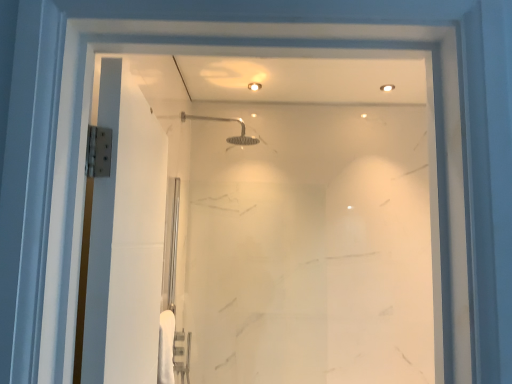
The image size is (512, 384). What do you see at coordinates (267, 221) in the screenshot? I see `transparent glass door at center` at bounding box center [267, 221].

Measure the distance between point (393, 321) and camera.

Point (393, 321) is 2.73 meters away from camera.

Find the location of a particular element. transparent glass door at center is located at coordinates (267, 221).

What is the approximate height of satin nickel shower head at upper center?

It is 7.47 inches.

Identify the location of satin nickel shower head at upper center. This screenshot has width=512, height=384. (226, 121).

The image size is (512, 384). What do you see at coordinates (226, 121) in the screenshot? I see `satin nickel shower head at upper center` at bounding box center [226, 121].

At what (x,y) coordinates should I click in order to perform the action: click on transparent glass door at center. Please return your answer as a coordinate pair (x, y). This screenshot has width=512, height=384. Looking at the image, I should click on (267, 221).

In the image, is transparent glass door at center on the left side or the right side of satin nickel shower head at upper center?

transparent glass door at center is positioned on satin nickel shower head at upper center's right side.

Is the position of transparent glass door at center less distant than that of satin nickel shower head at upper center?

Yes, transparent glass door at center is in front of satin nickel shower head at upper center.

Is point (413, 361) closer or farther from the camera than point (245, 137)?

Point (413, 361) is closer to the camera than point (245, 137).

From the image's perspective, is transparent glass door at center positioned above or below satin nickel shower head at upper center?

transparent glass door at center is below satin nickel shower head at upper center.

From a real-world perspective, is transparent glass door at center positioned under satin nickel shower head at upper center based on gravity?

Yes, from a real-world perspective, transparent glass door at center is beneath satin nickel shower head at upper center.

Considering the relative sizes of transparent glass door at center and satin nickel shower head at upper center in the image provided, is transparent glass door at center thinner than satin nickel shower head at upper center?

Yes.

In terms of height, does transparent glass door at center look taller or shorter compared to satin nickel shower head at upper center?

In the image, transparent glass door at center appears to be taller than satin nickel shower head at upper center.

Which of these two, transparent glass door at center or satin nickel shower head at upper center, is bigger?

With larger size is transparent glass door at center.

Would you say transparent glass door at center is inside or outside satin nickel shower head at upper center?

transparent glass door at center is not inside satin nickel shower head at upper center, it's outside.

Is transparent glass door at center with satin nickel shower head at upper center?

There is a gap between transparent glass door at center and satin nickel shower head at upper center.

Does transparent glass door at center turn towards satin nickel shower head at upper center?

Yes, transparent glass door at center is facing satin nickel shower head at upper center.

How many degrees apart are the facing directions of transparent glass door at center and satin nickel shower head at upper center?

There is a 88.6-degree angle between the facing directions of transparent glass door at center and satin nickel shower head at upper center.

Locate an element on the screen. This screenshot has width=512, height=384. glass door below the satin nickel shower head at upper center (from the image's perspective) is located at coordinates click(267, 221).

Which is more to the left, satin nickel shower head at upper center or transparent glass door at center?

satin nickel shower head at upper center is more to the left.

Which object is further away from the camera, satin nickel shower head at upper center or transparent glass door at center?

satin nickel shower head at upper center is further away from the camera.

Is point (241, 121) less distant than point (313, 306)?

No, it is not.

From the image's perspective, is satin nickel shower head at upper center above or below transparent glass door at center?

From the image's perspective, satin nickel shower head at upper center appears above transparent glass door at center.

From a real-world perspective, is satin nickel shower head at upper center located higher than transparent glass door at center?

Yes, from a real-world perspective, satin nickel shower head at upper center is over transparent glass door at center

Between satin nickel shower head at upper center and transparent glass door at center, which one has smaller width?

With smaller width is transparent glass door at center.

Considering the relative sizes of satin nickel shower head at upper center and transparent glass door at center in the image provided, is satin nickel shower head at upper center shorter than transparent glass door at center?

Yes.

Is satin nickel shower head at upper center bigger than transparent glass door at center?

Incorrect, satin nickel shower head at upper center is not larger than transparent glass door at center.

In the scene shown: Would you say satin nickel shower head at upper center is inside or outside transparent glass door at center?

satin nickel shower head at upper center cannot be found inside transparent glass door at center.

Are satin nickel shower head at upper center and transparent glass door at center making contact?

No, satin nickel shower head at upper center is not with transparent glass door at center.

In the scene shown: Is satin nickel shower head at upper center positioned with its back to transparent glass door at center?

No, satin nickel shower head at upper center is not facing away from transparent glass door at center.

Where is `glass door on the right of satin nickel shower head at upper center`? The width and height of the screenshot is (512, 384). glass door on the right of satin nickel shower head at upper center is located at coordinates (267, 221).

This screenshot has width=512, height=384. What are the coordinates of `shower behind the transparent glass door at center` in the screenshot? It's located at (226, 121).

You are a GUI agent. You are given a task and a screenshot of the screen. Output one action in this format:
    pyautogui.click(x=<x>, y=<y>)
    Task: Click on the shower lying on the left of transparent glass door at center
    This screenshot has height=384, width=512.
    Given the screenshot: What is the action you would take?
    pyautogui.click(x=226, y=121)